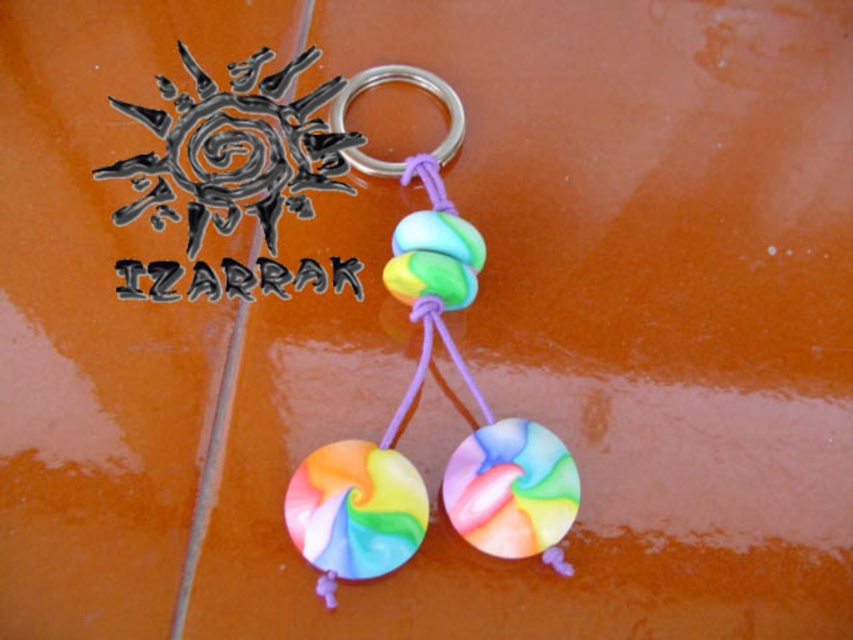
Question: Which point is farther to the camera?

Choices:
 (A) swirled glass bead at center
 (B) rainbow marbled bead at center
 (C) rainbow swirl glass bead at center

Answer: (C)

Question: Does swirled polymer clay keychain at center appear over rainbow swirl glass bead at center?

Choices:
 (A) yes
 (B) no

Answer: (B)

Question: Is swirled polymer clay keychain at center positioned in front of rainbow marbled bead at center?

Choices:
 (A) no
 (B) yes

Answer: (B)

Question: Is swirled polymer clay keychain at center thinner than swirled glass bead at center?

Choices:
 (A) no
 (B) yes

Answer: (A)

Question: Which of the following is the farthest from the observer?

Choices:
 (A) (433, 257)
 (B) (352, 166)
 (C) (323, 452)

Answer: (B)

Question: Which of these objects is positioned closest to the swirled glass bead at center?

Choices:
 (A) rainbow marbled bead at center
 (B) swirled polymer clay keychain at center
 (C) rainbow swirl glass bead at center

Answer: (C)